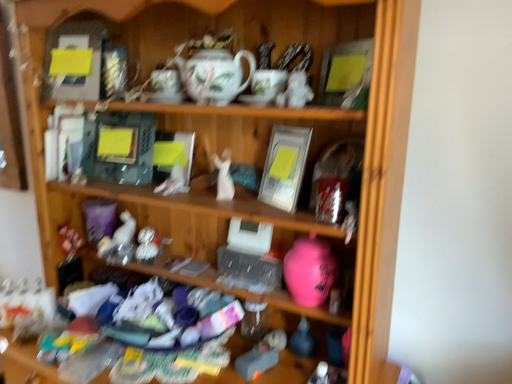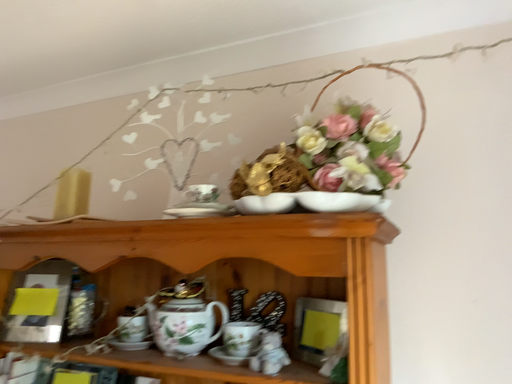
Question: Which way did the camera rotate in the video?

Choices:
 (A) rotated downward
 (B) rotated upward

Answer: (B)